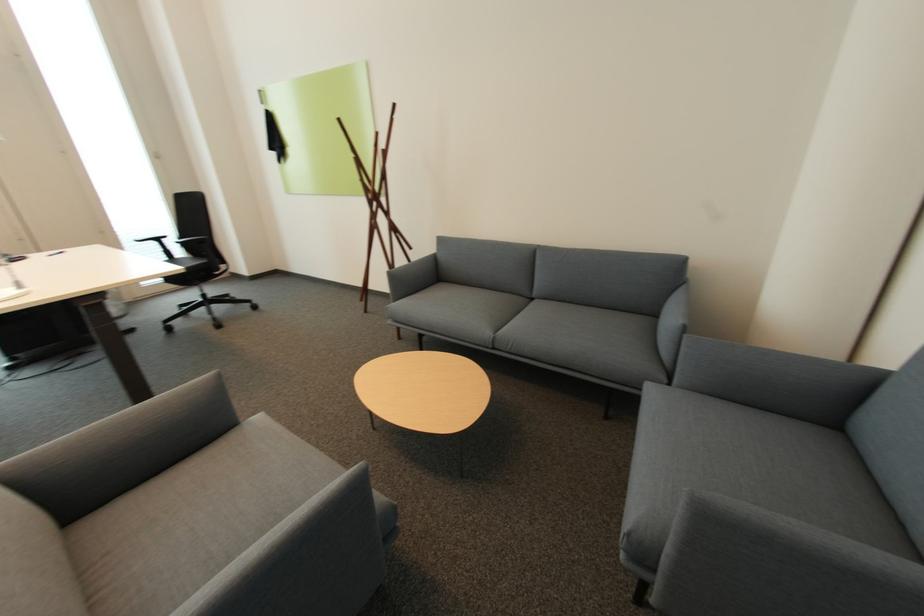
Find where to sit the sofa sitting surface. Please return your answer as a coordinate pair (x, y).

(480, 312)